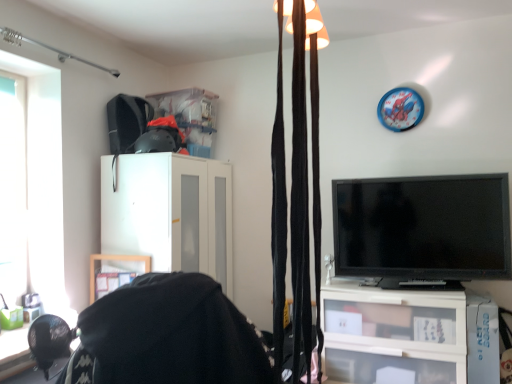
Question: Considering the positions of white matte cabinet at center and transparent glass window at left in the image, is white matte cabinet at center wider or thinner than transparent glass window at left?

Choices:
 (A) wide
 (B) thin

Answer: (A)

Question: Is white matte cabinet at center taller or shorter than transparent glass window at left?

Choices:
 (A) short
 (B) tall

Answer: (B)

Question: Based on their relative distances, which object is nearer to the black fabric bean bag chair at lower left?

Choices:
 (A) black glossy tv at right
 (B) white matte cabinet at center
 (C) blue plastic clock at upper right
 (D) transparent glass window at left
 (E) black velvet curtains at upper center

Answer: (E)

Question: Which object is positioned closest to the blue plastic clock at upper right?

Choices:
 (A) black fabric bean bag chair at lower left
 (B) black velvet curtains at upper center
 (C) black glossy tv at right
 (D) transparent glass window at left
 (E) white matte cabinet at center

Answer: (C)